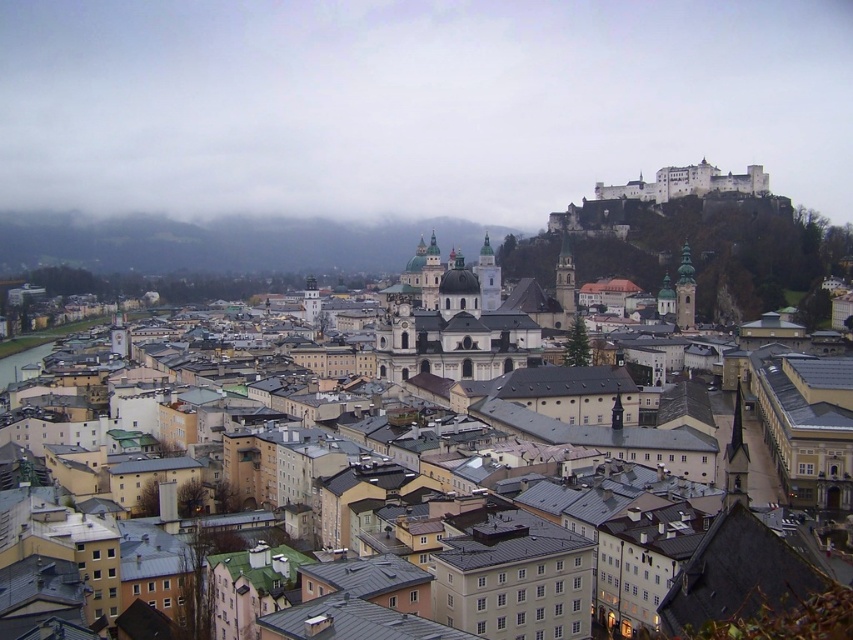
You are an architect analyzing the city layout. Based on the scene, which of the two structures, the brown textured buildings at center or the white stone church at center, occupies more space in the cityscape?

The brown textured buildings at center is bigger than the white stone church at center, so it occupies more space in the cityscape.

You are an architect analyzing the city layout. You observe the brown textured buildings at center and the white stone church at center in the midground. Which structure occupies more horizontal space in the image?

The brown textured buildings at center are wider than the white stone church at center, so they occupy more horizontal space in the image.

Based on the provided scene description, where exactly are the brown textured buildings at center located in terms of coordinates?

The brown textured buildings at center are located at coordinates point (67,448).